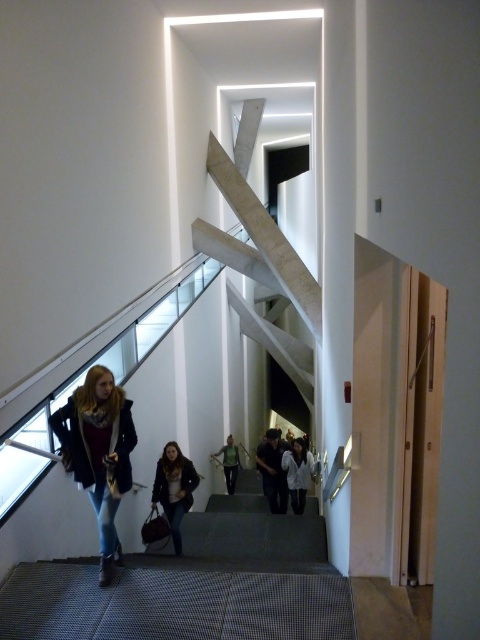
You are standing at the bottom of the staircase and see both the denim jacket at center and the green fabric shirt at center lying on the steps. Which item is taller?

The denim jacket at center is much taller than the green fabric shirt at center.